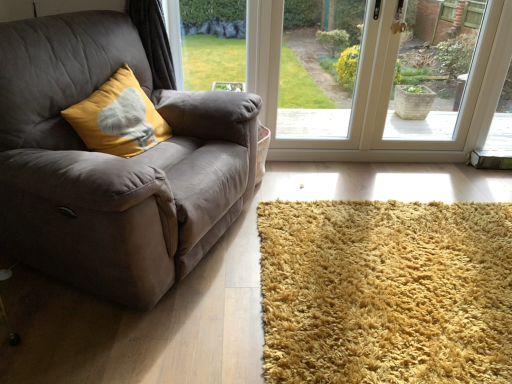
Question: Considering the positions of point (384, 8) and point (485, 253), is point (384, 8) closer or farther from the camera than point (485, 253)?

Choices:
 (A) closer
 (B) farther

Answer: (B)

Question: Would you say transparent glass window at center is to the left or to the right of shaggy golden rug at lower right in the picture?

Choices:
 (A) right
 (B) left

Answer: (B)

Question: Which of these objects is positioned closest to the green grass at upper center, the 1th window screen in the left-to-right sequence?

Choices:
 (A) transparent glass window at center
 (B) white textured basket at upper right, the 3th window screen positioned from the left
 (C) shaggy golden rug at lower right
 (D) transparent glass door at center, acting as the 2th window screen starting from the right
 (E) mustard velvet cushion at left

Answer: (D)

Question: Which object is positioned farthest from the suede gray couch at left?

Choices:
 (A) transparent glass door at center, the second window screen positioned from the left
 (B) white textured basket at upper right, the 1th window screen when ordered from right to left
 (C) green grass at upper center, the 3th window screen from the right
 (D) transparent glass window at center
 (E) mustard velvet cushion at left

Answer: (C)